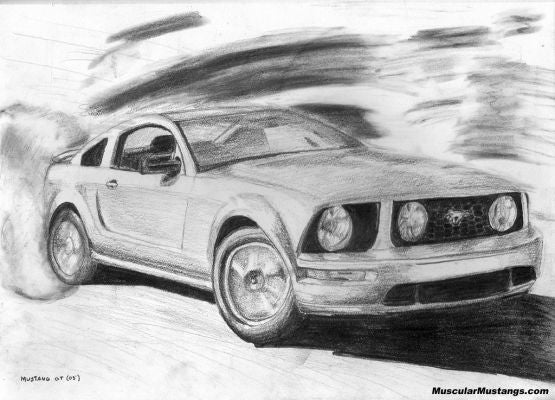
Identify the location of right door handle. This screenshot has height=400, width=555. (113, 181).